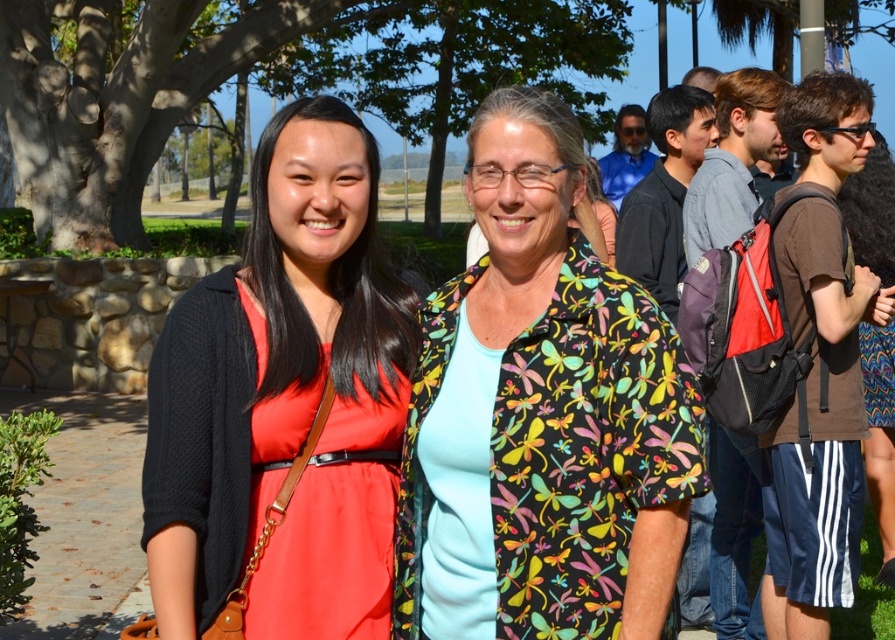
You are a photographer at a park event and notice two items at the center of your frame. The items are the multicolored floral shirt at center and the matte black cardigan at center. Which item should you focus on if you want to capture the larger object in your photo?

The multicolored floral shirt at center is larger in size than the matte black cardigan at center, so you should focus on the multicolored floral shirt at center to capture the larger object.

You are a photographer at the park and want to take a photo of the multicolored floral shirt at center and the matte black cardigan at center. Which object should you focus on first if you want to capture both in one frame without moving the camera?

The multicolored floral shirt at center is much taller than the matte black cardigan at center, so you should focus on the taller one first to ensure it is in frame.